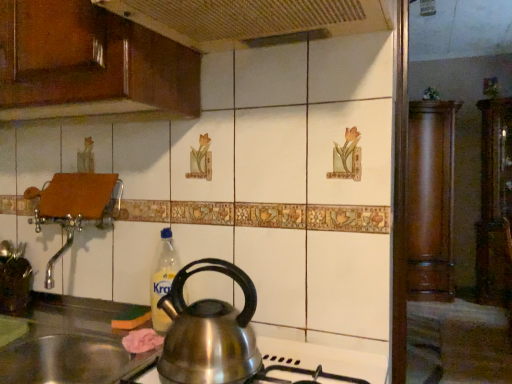
Question: From the image's perspective, is wooden cabinet at right, the 3th cabinetry positioned from the left, positioned above or below stainless steel sink at lower left?

Choices:
 (A) below
 (B) above

Answer: (B)

Question: Does point (480, 167) appear closer or farther from the camera than point (11, 379)?

Choices:
 (A) farther
 (B) closer

Answer: (A)

Question: Which object is the farthest from the polished stainless steel kettle at lower center?

Choices:
 (A) mahogany wood cabinet at right, the 3th cabinetry positioned from the front
 (B) matte brown pot at left
 (C) stainless steel sink at lower left
 (D) wooden panel at upper left
 (E) wooden cabinet at right, the first cabinetry positioned from the right

Answer: (E)

Question: Which object is positioned farthest from the wooden panel at upper left?

Choices:
 (A) matte brown pot at left
 (B) wooden cabinet at right, the first cabinetry positioned from the right
 (C) polished stainless steel kettle at lower center
 (D) stainless steel sink at lower left
 (E) mahogany wood cabinet at right, which ranks as the 2th cabinetry in left-to-right order

Answer: (B)